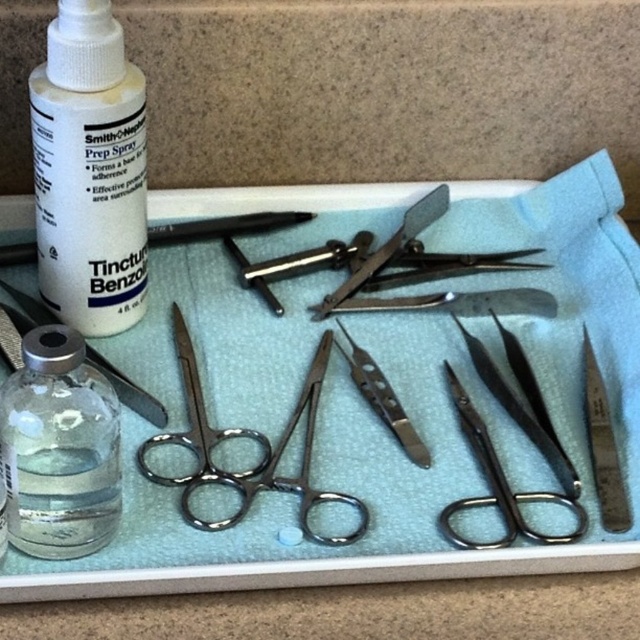
Is point (80, 65) positioned in front of point (278, 451)?

Yes, it is.

Is point (48, 241) less distant than point (365, 524)?

No.

Where is `white plastic bottle at upper left`? white plastic bottle at upper left is located at coordinates (90, 172).

Is point (102, 60) closer to camera compared to point (474, 432)?

That is True.

The width and height of the screenshot is (640, 640). I want to click on white plastic bottle at upper left, so click(90, 172).

Where is `white plastic bottle at upper left`? white plastic bottle at upper left is located at coordinates (90, 172).

Which of these two, polished silver scissors at lower right or polished metal scissors at center, stands taller?

polished metal scissors at center

Who is lower down, polished silver scissors at lower right or polished metal scissors at center?

polished silver scissors at lower right

Which is behind, point (548, 493) or point (330, 294)?

The point (330, 294) is behind.

Find the location of a particular element. This screenshot has width=640, height=640. polished silver scissors at lower right is located at coordinates (497, 484).